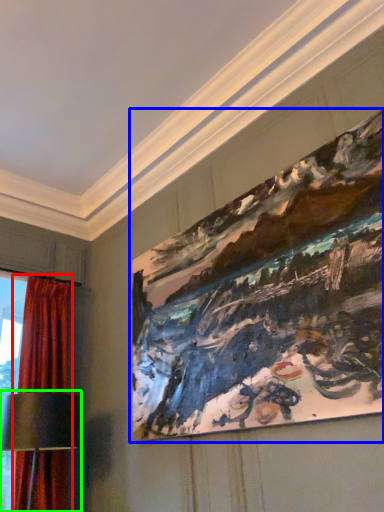
Question: Which object is the farthest from curtain (highlighted by a red box)? Choose among these: picture frame (highlighted by a blue box) or table lamp (highlighted by a green box).

Choices:
 (A) picture frame
 (B) table lamp

Answer: (A)